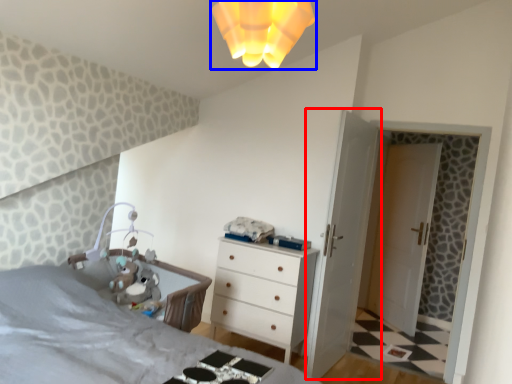
Question: Among these objects, which one is farthest to the camera, door (highlighted by a red box) or light fixture (highlighted by a blue box)?

Choices:
 (A) door
 (B) light fixture

Answer: (A)